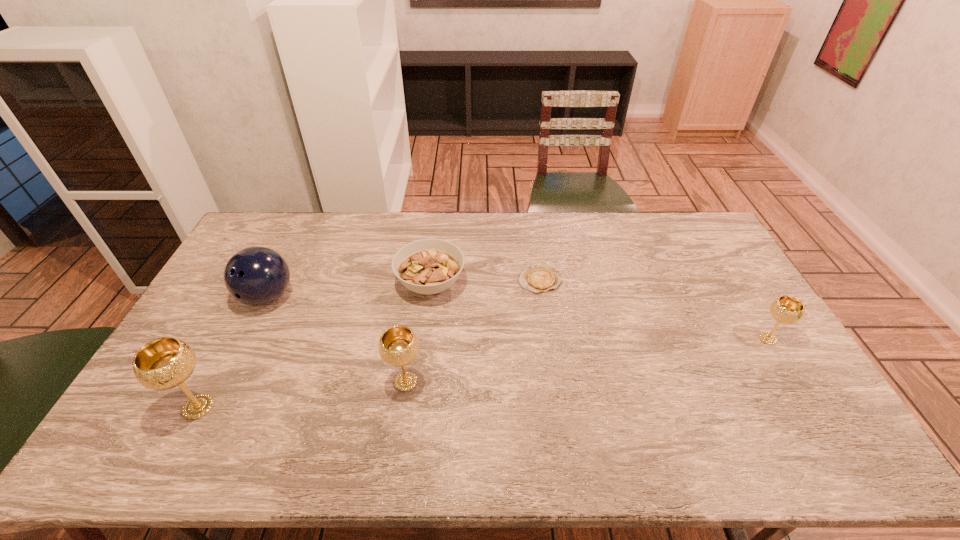
Locate an element on the screen. The height and width of the screenshot is (540, 960). free point between the shortest object and the bowling ball is located at coordinates (404, 288).

The image size is (960, 540). In order to click on free space between the tallest chalice and the quiche in this screenshot , I will do `click(370, 343)`.

At what (x,y) coordinates should I click in order to perform the action: click on blank region between the second shortest chalice and the second shortest object. Please return your answer as a coordinate pair (x, y). This screenshot has height=540, width=960. Looking at the image, I should click on (419, 333).

The height and width of the screenshot is (540, 960). Identify the location of object that stands as the fourth closest to the tallest chalice. (538, 279).

You are a GUI agent. You are given a task and a screenshot of the screen. Output one action in this format:
    pyautogui.click(x=<x>, y=<y>)
    Task: Click on the object that is the second closest to the tallest chalice
    This screenshot has width=960, height=540.
    Given the screenshot: What is the action you would take?
    pyautogui.click(x=398, y=346)

Find the location of `the second closest chalice to the fourth tallest object`. the second closest chalice to the fourth tallest object is located at coordinates tap(164, 363).

What are the coordinates of `chalice that stands as the closest to the second tallest chalice` in the screenshot? It's located at (164, 363).

The width and height of the screenshot is (960, 540). What are the coordinates of `free location that satisfies the following two spatial constraints: 1. on the back side of the second shortest object; 2. on the right side of the leftmost chalice` in the screenshot? It's located at (262, 284).

Locate an element on the screen. This screenshot has height=540, width=960. free location that satisfies the following two spatial constraints: 1. on the back side of the quiche; 2. on the left side of the second chalice from left to right is located at coordinates (420, 280).

The image size is (960, 540). Identify the location of free point that satisfies the following two spatial constraints: 1. on the back side of the second chalice from left to right; 2. on the left side of the third nearest object. (412, 339).